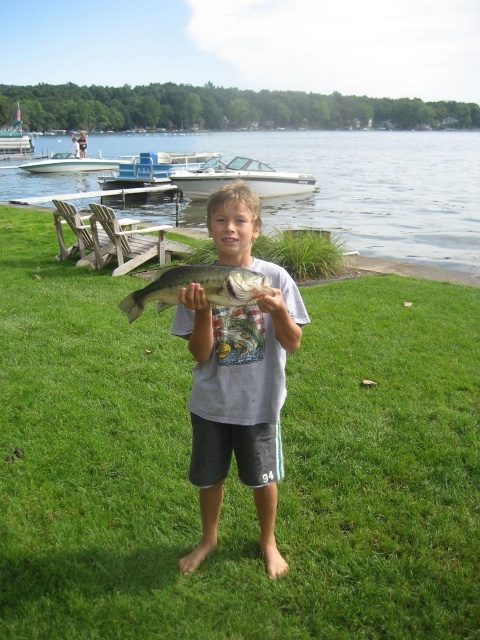
How far apart are shiny silver fish at center and white glossy boat at center?

They are 18.95 meters apart.

Who is lower down, shiny silver fish at center or white glossy boat at center?

Positioned lower is shiny silver fish at center.

Locate an element on the screen. This screenshot has width=480, height=640. shiny silver fish at center is located at coordinates (238, 376).

Identify the location of shiny silver fish at center. (238, 376).

Is blue plastic boat at center wider than white glossy boat at upper left?

No.

Is point (173, 160) closer to camera compared to point (36, 168)?

Yes, it is in front of point (36, 168).

Where is `blue plastic boat at center`? The width and height of the screenshot is (480, 640). blue plastic boat at center is located at coordinates (154, 168).

Is wooden dock at left closer to the viewer compared to white glossy boat at upper left?

Yes.

Who is shorter, wooden dock at left or white glossy boat at upper left?

Standing shorter between the two is wooden dock at left.

Which is in front, point (145, 257) or point (116, 161)?

Point (145, 257)

Locate an element on the screen. This screenshot has height=640, width=480. wooden dock at left is located at coordinates (111, 237).